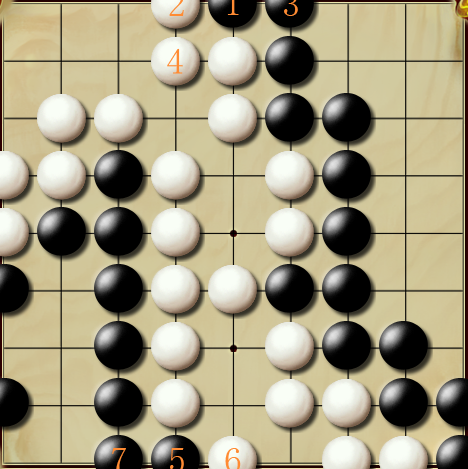
Where is `game piece with an orange numeral on top`? This screenshot has height=469, width=468. game piece with an orange numeral on top is located at coordinates (175, 66), (176, 9), (236, 9), (295, 10), (118, 458), (181, 458), (233, 460).